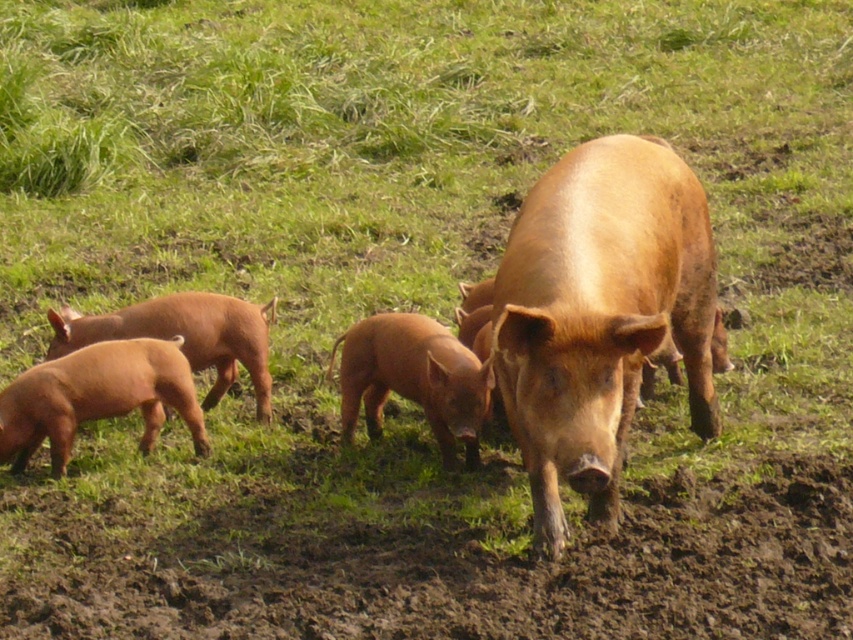
Question: Which point is farther to the camera?

Choices:
 (A) (372, 605)
 (B) (688, 182)
 (C) (126, 330)

Answer: (C)

Question: Is brown muddy ground at center to the left of matte brown piglet at lower left from the viewer's perspective?

Choices:
 (A) no
 (B) yes

Answer: (A)

Question: Which object is farther from the camera taking this photo?

Choices:
 (A) matte brown piglet at center
 (B) matte brown piglet at lower left
 (C) brown muddy ground at center

Answer: (B)

Question: Is the position of matte brown piglet at center less distant than that of matte brown piglet at lower left?

Choices:
 (A) yes
 (B) no

Answer: (A)

Question: Based on their relative distances, which object is farther from the brown muddy ground at center?

Choices:
 (A) smooth brown piglet at lower left
 (B) matte brown piglet at center
 (C) matte brown piglet at lower left
 (D) matte brown pig at center

Answer: (C)

Question: Can you confirm if brown muddy ground at center is positioned to the right of smooth brown piglet at lower left?

Choices:
 (A) yes
 (B) no

Answer: (A)